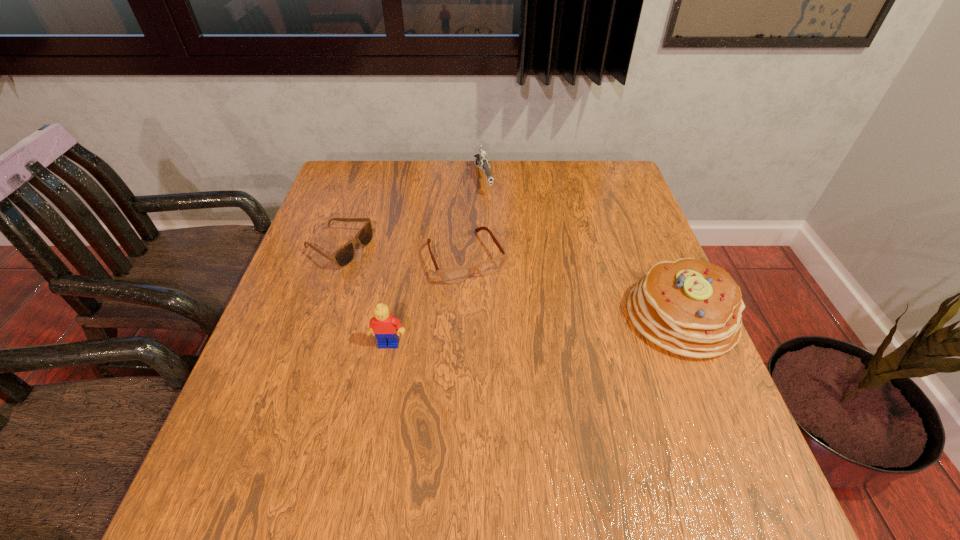
At what (x,y) coordinates should I click in order to perform the action: click on vacant area situated aimed along the barrel of the farthest object. Please return your answer as a coordinate pair (x, y). This screenshot has height=540, width=960. Looking at the image, I should click on (498, 239).

At what (x,y) coordinates should I click in order to perform the action: click on vacant space located 0.260m on the front-facing side of the spectacles. Please return your answer as a coordinate pair (x, y). The width and height of the screenshot is (960, 540). Looking at the image, I should click on (522, 373).

I want to click on vacant space located on the front-facing side of the spectacles, so click(x=524, y=376).

The height and width of the screenshot is (540, 960). Identify the location of vacant space located 0.050m on the front-facing side of the spectacles. (487, 299).

The height and width of the screenshot is (540, 960). Identify the location of free space located 0.160m on the frames of the leftmost object. (420, 277).

Locate an element on the screen. free region located 0.290m on the frames of the leftmost object is located at coordinates (468, 294).

The height and width of the screenshot is (540, 960). Identify the location of blank space located on the frames of the leftmost object. (479, 298).

Locate an element on the screen. object located at the far edge is located at coordinates (481, 160).

You are a GUI agent. You are given a task and a screenshot of the screen. Output one action in this format:
    pyautogui.click(x=<x>, y=<y>)
    Task: Click on the object that is at the left edge
    This screenshot has width=960, height=540.
    Given the screenshot: What is the action you would take?
    pyautogui.click(x=343, y=256)

Identify the location of object at the right edge. (690, 307).